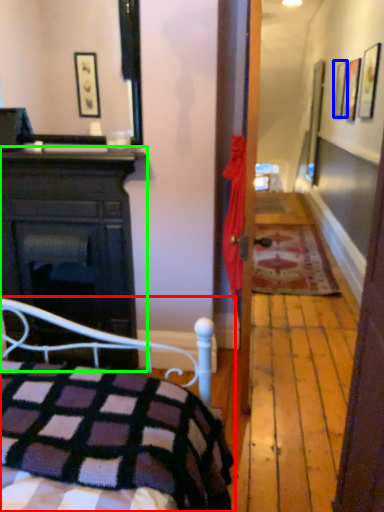
Question: Which is nearer to the bed (highlighted by a red box)? picture frame (highlighted by a blue box) or cabinetry (highlighted by a green box).

Choices:
 (A) picture frame
 (B) cabinetry

Answer: (B)